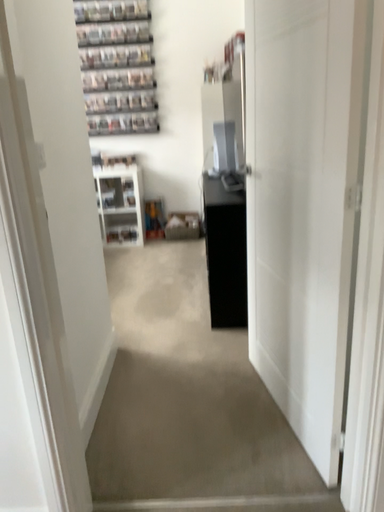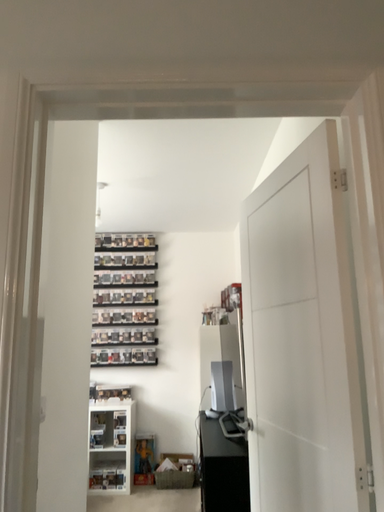
Question: How did the camera likely rotate when shooting the video?

Choices:
 (A) rotated upward
 (B) rotated downward

Answer: (A)